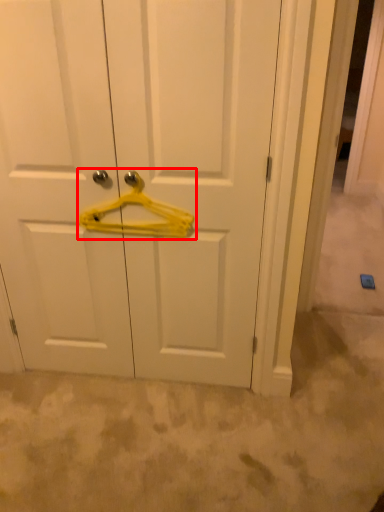
Question: From the image's perspective, what is the correct spatial positioning of hanger (annotated by the red box) in reference to door?

Choices:
 (A) below
 (B) above

Answer: (B)